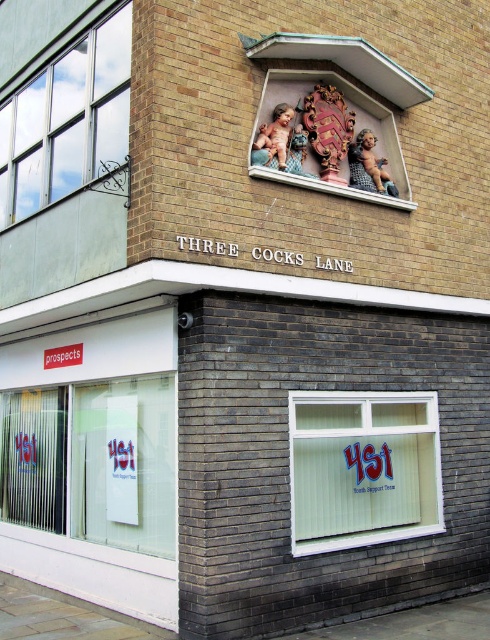
Between white plastic shop window at lower right and metallic glass window at upper left, which one appears on the right side from the viewer's perspective?

white plastic shop window at lower right is more to the right.

From the picture: Is white plastic shop window at lower right thinner than metallic glass window at upper left?

Yes, white plastic shop window at lower right is thinner than metallic glass window at upper left.

Which is behind, point (402, 500) or point (22, 218)?

Point (22, 218)

Where is `white plastic shop window at lower right`? The height and width of the screenshot is (640, 490). white plastic shop window at lower right is located at coordinates (363, 468).

Which is more to the right, transparent glass shop window at lower left or metallic glass window at upper left?

transparent glass shop window at lower left

Can you confirm if transparent glass shop window at lower left is shorter than metallic glass window at upper left?

No.

Does point (4, 424) come in front of point (19, 100)?

No, (4, 424) is further to viewer.

The image size is (490, 640). Find the location of `transparent glass shop window at lower left`. transparent glass shop window at lower left is located at coordinates (93, 461).

Does transparent glass shop window at lower left have a lesser width compared to white plastic shop window at lower right?

In fact, transparent glass shop window at lower left might be wider than white plastic shop window at lower right.

Between transparent glass shop window at lower left and white plastic shop window at lower right, which one has more height?

With more height is transparent glass shop window at lower left.

This screenshot has width=490, height=640. Describe the element at coordinates (93, 461) in the screenshot. I see `transparent glass shop window at lower left` at that location.

Where is `transparent glass shop window at lower left`? The height and width of the screenshot is (640, 490). transparent glass shop window at lower left is located at coordinates (93, 461).